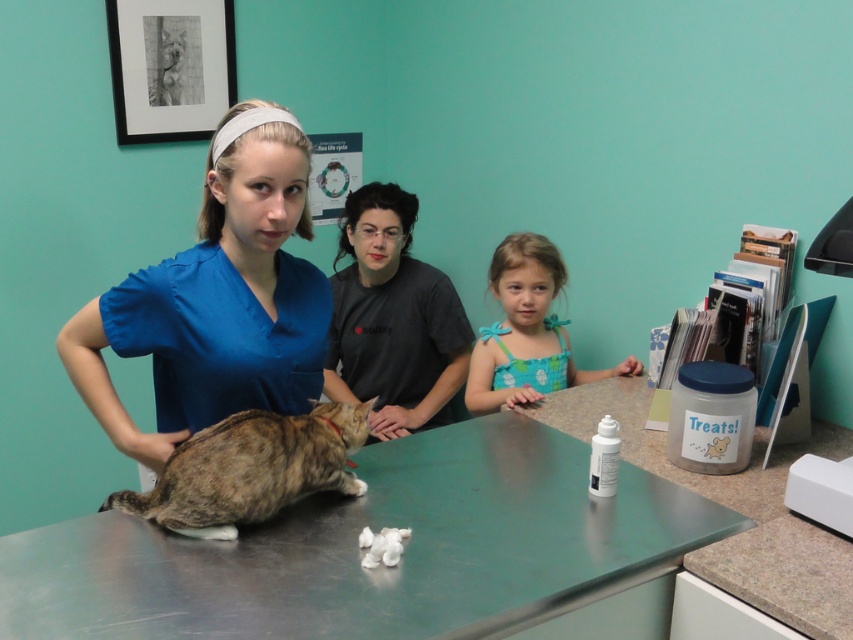
Question: Is stainless steel table at center to the left of blue scrubs at center from the viewer's perspective?

Choices:
 (A) yes
 (B) no

Answer: (B)

Question: Which of the following is the farthest from the observer?

Choices:
 (A) (643, 458)
 (B) (173, 388)
 (C) (405, 316)

Answer: (C)

Question: Does stainless steel table at center come behind blue polka dot dress at center?

Choices:
 (A) yes
 (B) no

Answer: (B)

Question: Estimate the real-world distances between objects in this image. Which object is closer to the black matte shirt at center?

Choices:
 (A) tabby fur cat at center
 (B) blue scrubs at center

Answer: (B)

Question: Which object is closer to the camera taking this photo?

Choices:
 (A) black matte shirt at center
 (B) tabby fur cat at center
 (C) green stainless steel counter top at center

Answer: (C)

Question: Does blue scrubs at center have a lesser width compared to tabby fur cat at center?

Choices:
 (A) yes
 (B) no

Answer: (A)